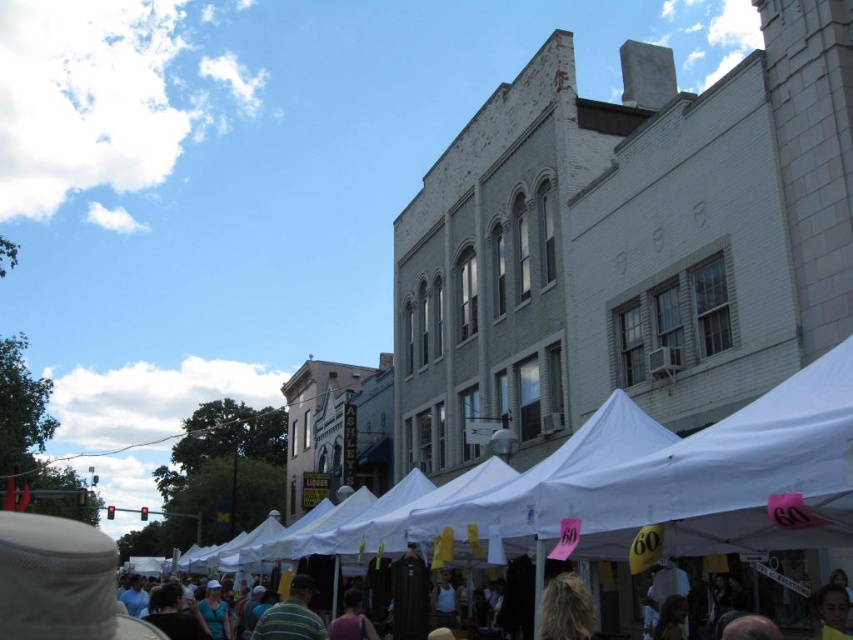
Question: Estimate the real-world distances between objects in this image. Which object is farther from the striped fabric at center?

Choices:
 (A) dark gray fabric crowd at center
 (B) white fabric tent at center

Answer: (B)

Question: Which of these objects is positioned farthest from the striped fabric at center?

Choices:
 (A) dark gray fabric crowd at center
 (B) white fabric tent at center

Answer: (B)

Question: Is white fabric tent at center above dark gray fabric crowd at center?

Choices:
 (A) no
 (B) yes

Answer: (B)

Question: Is striped fabric at center further to camera compared to dark gray fabric crowd at center?

Choices:
 (A) no
 (B) yes

Answer: (B)

Question: Observing the image, what is the correct spatial positioning of striped fabric at center in reference to dark gray fabric crowd at center?

Choices:
 (A) left
 (B) right

Answer: (A)

Question: Which object is the farthest from the striped fabric at center?

Choices:
 (A) dark gray fabric crowd at center
 (B) white fabric tent at center

Answer: (B)